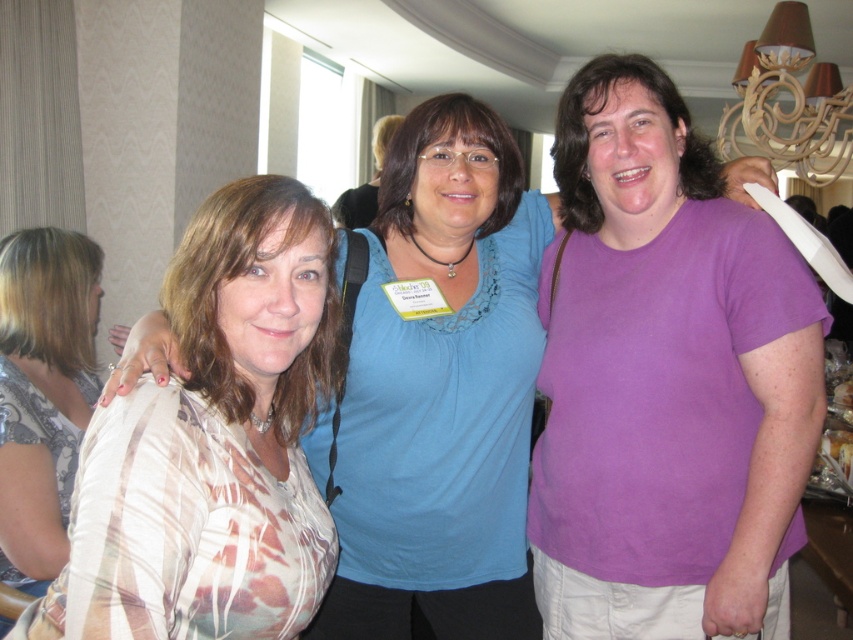
You are trying to decide which of the two shirts at the center of the image, the purple matte shirt at center or the plaid fabric shirt at center, would better fit into a narrow closet space. Based on their widths, which shirt should you choose?

The purple matte shirt at center might be wider than plaid fabric shirt at center, so the plaid fabric shirt at center would be better for a narrow closet space since it is narrower.

In the scene shown: You are taking a photo of two women wearing plaid fabric shirts. The woman in the center is wearing a plaid fabric shirt at center, and the woman on the left is wearing a plaid fabric shirt at left. Which plaid fabric shirt is closer to you?

The plaid fabric shirt at center is closer to the viewer than the plaid fabric shirt at left.